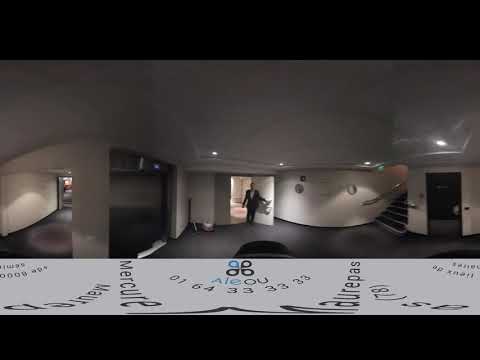
Identify the location of stair railing. (407, 202), (379, 196).